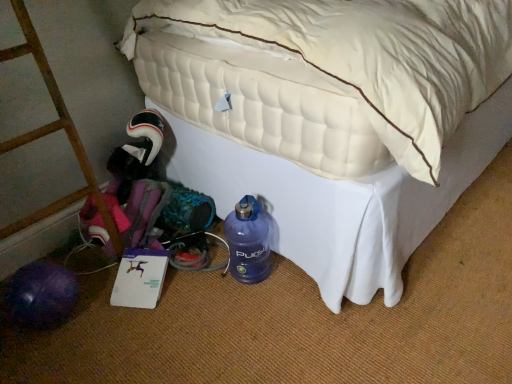
You are a GUI agent. You are given a task and a screenshot of the screen. Output one action in this format:
    pyautogui.click(x=<x>, y=<y>)
    Task: Click on the free space in front of brushed metal ladder at left
    The image size is (512, 384).
    Given the screenshot: What is the action you would take?
    pyautogui.click(x=69, y=352)